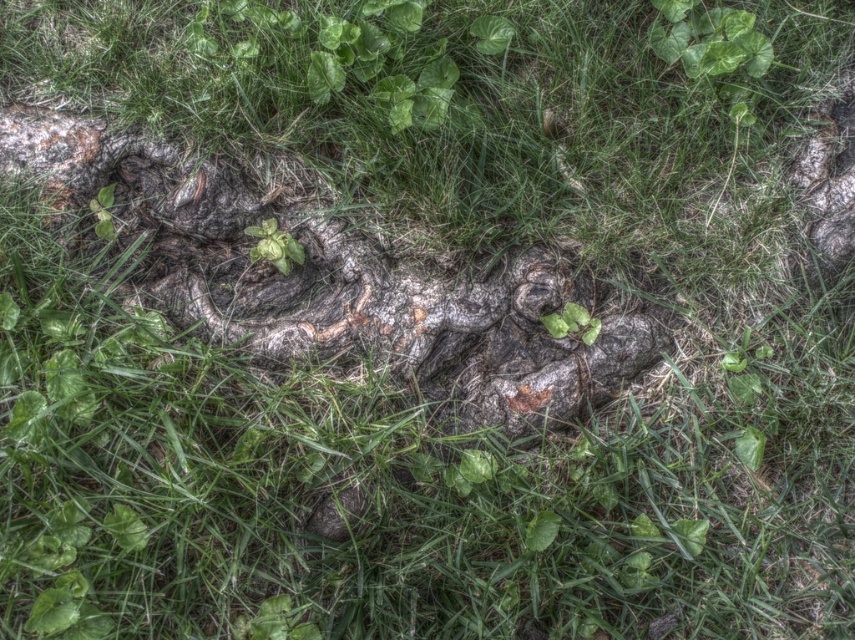
Between green matte leaf at upper center and green matte plant at center, which one appears on the right side from the viewer's perspective?

From the viewer's perspective, green matte leaf at upper center appears more on the right side.

Who is positioned more to the left, green matte leaf at upper center or green matte plant at center?

green matte plant at center is more to the left.

Locate an element on the screen. green matte leaf at upper center is located at coordinates (708, 38).